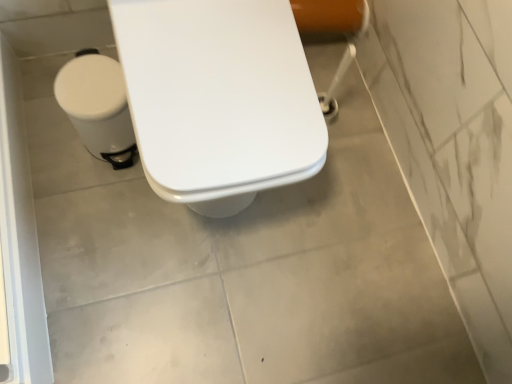
This screenshot has height=384, width=512. What do you see at coordinates (97, 106) in the screenshot?
I see `white plastic toilet bowl at left` at bounding box center [97, 106].

Where is `white plastic toilet bowl at left`? white plastic toilet bowl at left is located at coordinates (97, 106).

Looking at this image, what is the approximate width of white plastic toilet bowl at left?

The width of white plastic toilet bowl at left is 6.72 inches.

Image resolution: width=512 pixels, height=384 pixels. What are the coordinates of `white plastic toilet bowl at left` in the screenshot? It's located at (97, 106).